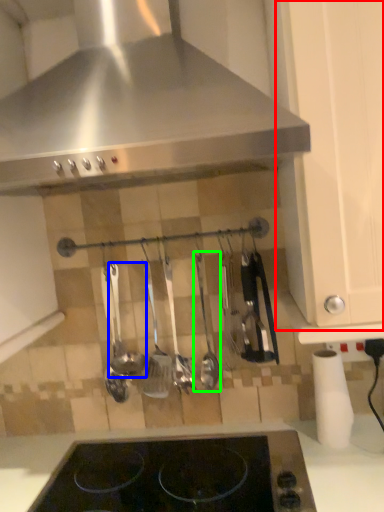
Question: Based on their relative distances, which object is nearer to cabinetry (highlighted by a red box)? Choose from utensil (highlighted by a blue box) and silverware (highlighted by a green box).

Choices:
 (A) utensil
 (B) silverware

Answer: (B)